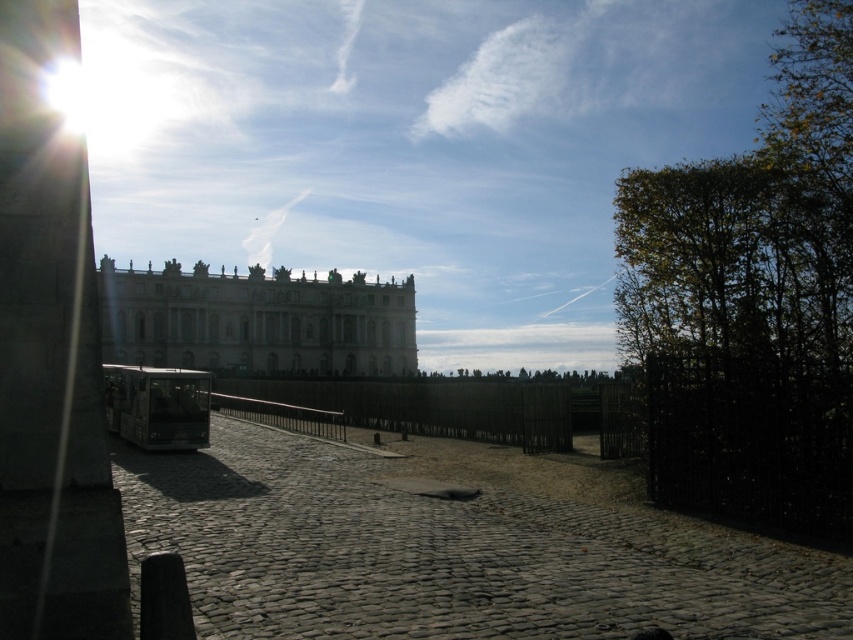
You are standing at the entrance of the grand classical building and want to take a photo of the green leafy tree at right. Which direction should you face to ensure the tree is in the frame?

The green leafy tree at right is located at point (753, 298), which is to the right side of the scene. Therefore, you should face towards the right direction to include the tree in your photo.